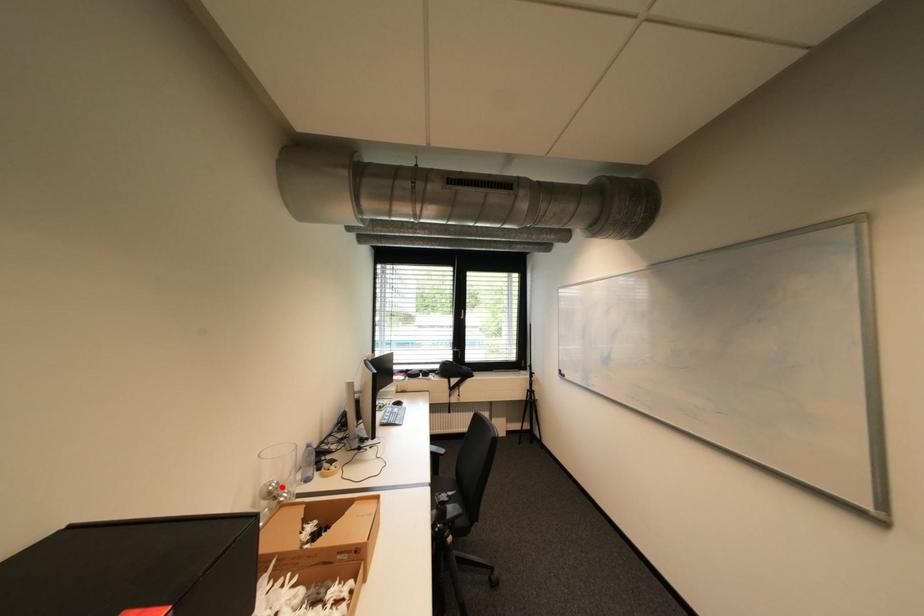
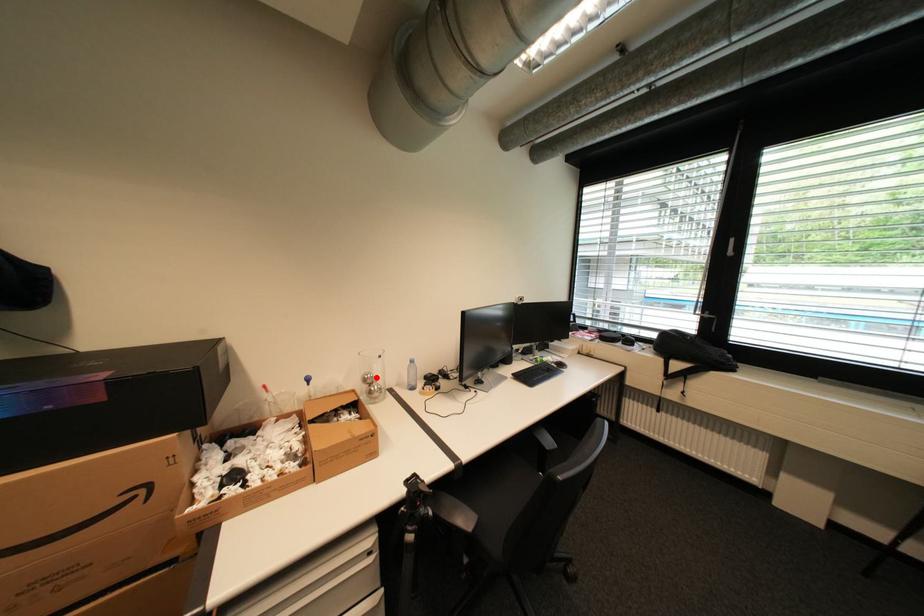
I am providing you with two images of the same scene from different viewpoints. A red point is marked on the first image and another point is marked on the second image. Are the points marked in image1 and image2 representing the same 3D position?

Yes